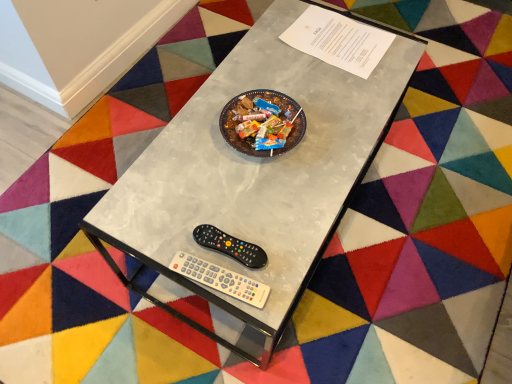
At what (x,y) coordinates should I click in order to perform the action: click on vacant space behind black plastic remote at lower center. Please return your answer as a coordinate pair (x, y). The image size is (512, 384). Looking at the image, I should click on (229, 187).